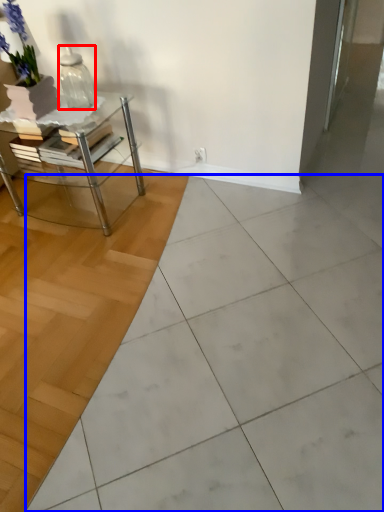
Question: Which point is closer to the camera, vase (highlighted by a red box) or ceramic tile (highlighted by a blue box)?

Choices:
 (A) vase
 (B) ceramic tile

Answer: (B)